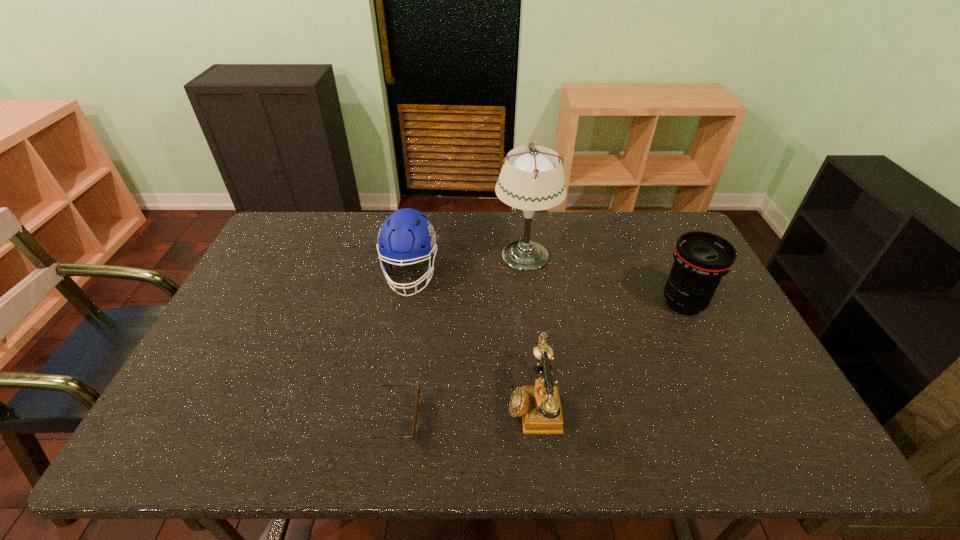
In the image, there is a desktop. Where is `vacant space at the near edge`? vacant space at the near edge is located at coordinates (506, 432).

What are the coordinates of `free space at the left edge of the desktop` in the screenshot? It's located at (242, 326).

This screenshot has width=960, height=540. In order to click on free space at the right edge of the desktop in this screenshot , I will do `click(667, 260)`.

In the image, there is a desktop. Where is `vacant space at the far right corner`? The width and height of the screenshot is (960, 540). vacant space at the far right corner is located at coordinates (675, 225).

Where is `free space that is in between the football helmet and the tallest object`? The height and width of the screenshot is (540, 960). free space that is in between the football helmet and the tallest object is located at coordinates [x=468, y=265].

I want to click on free space between the rightmost object and the football helmet, so click(x=547, y=288).

At what (x,y) coordinates should I click in order to perform the action: click on empty location between the shortest object and the rightmost object. Please return your answer as a coordinate pair (x, y). The image size is (960, 540). Looking at the image, I should click on (539, 361).

Image resolution: width=960 pixels, height=540 pixels. Identify the location of free space between the spectacles and the football helmet. (402, 347).

Locate an element on the screen. The image size is (960, 540). free point between the shortest object and the tallest object is located at coordinates pyautogui.click(x=459, y=338).

What are the coordinates of `vacant space that is in between the football helmet and the telephone` in the screenshot? It's located at (472, 338).